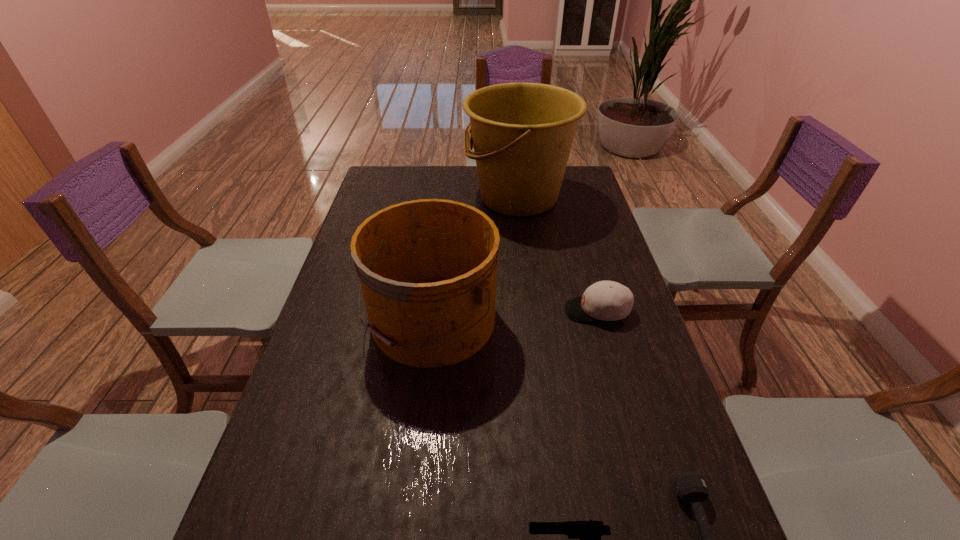
I want to click on object that is the closest one to the pistol, so click(x=690, y=486).

Locate which object ranks third in proximity to the farther bucket. Please provide its 2D coordinates. Your answer should be formatted as a tuple, i.e. [(x, y)], where the tuple contains the x and y coordinates of a point satisfying the conditions above.

[(690, 486)]